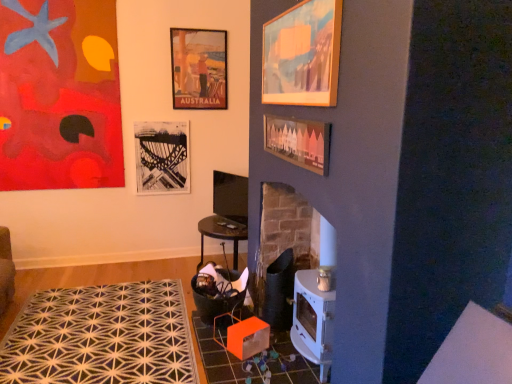
Measure the distance between point (32, 177) and camera.

Point (32, 177) and camera are 12.80 feet apart.

In the scene shown: In order to face wooden picture frame at upper center, positioned as the fifth picture frame in left-to-right order, should I rotate leftwards or rightwards?

You should look right and rotate roughly 4.920 degrees.

Find the location of a particular element. The width and height of the screenshot is (512, 384). wooden picture frame at upper center, positioned as the fifth picture frame in left-to-right order is located at coordinates (302, 55).

You are a GUI agent. You are given a task and a screenshot of the screen. Output one action in this format:
    pyautogui.click(x=<x>, y=<y>)
    Task: Click on the black paper picture frame at upper center, which is the 5th picture frame from front to back
    The height and width of the screenshot is (384, 512).
    Given the screenshot: What is the action you would take?
    pyautogui.click(x=162, y=157)

Measure the distance between point (197,81) and camera.

Point (197,81) and camera are 4.08 meters apart.

Find the location of a particular element. wooden picture frame at center, the 2th picture frame viewed from the right is located at coordinates [298, 142].

At what (x,y) coordinates should I click in order to perform the action: click on abstract painting at upper left, the 1th picture frame from the left. Please return your answer as a coordinate pair (x, y). Looking at the image, I should click on (59, 95).

Is there a large distance between abstract painting at upper left, the third picture frame positioned from the front, and matte paper poster at upper center, which is counted as the 4th picture frame, starting from the front?

No, abstract painting at upper left, the third picture frame positioned from the front, is not far away from matte paper poster at upper center, which is counted as the 4th picture frame, starting from the front.

In terms of height, does abstract painting at upper left, which ranks as the 3th picture frame in back-to-front order, look taller or shorter compared to matte paper poster at upper center, which ranks as the 2th picture frame in back-to-front order?

Considering their sizes, abstract painting at upper left, which ranks as the 3th picture frame in back-to-front order, has more height than matte paper poster at upper center, which ranks as the 2th picture frame in back-to-front order.

Is abstract painting at upper left, the third picture frame positioned from the front, surrounding matte paper poster at upper center, marked as the third picture frame in a left-to-right arrangement?

Actually, matte paper poster at upper center, marked as the third picture frame in a left-to-right arrangement, is outside abstract painting at upper left, the third picture frame positioned from the front.

Considering the relative sizes of abstract painting at upper left, the third picture frame positioned from the front, and matte paper poster at upper center, marked as the third picture frame in a left-to-right arrangement, in the image provided, is abstract painting at upper left, the third picture frame positioned from the front, smaller than matte paper poster at upper center, marked as the third picture frame in a left-to-right arrangement,?

Actually, abstract painting at upper left, the third picture frame positioned from the front, might be larger than matte paper poster at upper center, marked as the third picture frame in a left-to-right arrangement.

Does white geometric rug at lower left touch orange fabric rocking chair at lower left?

They are not placed beside each other.

Considering the sizes of white geometric rug at lower left and orange fabric rocking chair at lower left in the image, is white geometric rug at lower left bigger or smaller than orange fabric rocking chair at lower left?

Considering their sizes, white geometric rug at lower left takes up more space than orange fabric rocking chair at lower left.

Between white geometric rug at lower left and orange fabric rocking chair at lower left, which one has smaller width?

orange fabric rocking chair at lower left is thinner.

Is the depth of white geometric rug at lower left greater than that of orange fabric rocking chair at lower left?

No, the depth of white geometric rug at lower left is less than that of orange fabric rocking chair at lower left.

From a real-world perspective, is orange fabric rocking chair at lower left above or below black paper picture frame at upper center, which is counted as the 2th picture frame, starting from the left?

From a real-world perspective, orange fabric rocking chair at lower left is physically below black paper picture frame at upper center, which is counted as the 2th picture frame, starting from the left.

Between point (218, 292) and point (179, 154), which one is positioned in front?

The point (218, 292) is closer.

Which of these two, orange fabric rocking chair at lower left or black paper picture frame at upper center, the 1th picture frame when ordered from back to front, is thinner?

black paper picture frame at upper center, the 1th picture frame when ordered from back to front, is thinner.

Is orange fabric rocking chair at lower left bigger or smaller than black paper picture frame at upper center, which is the 5th picture frame from front to back?

orange fabric rocking chair at lower left is bigger than black paper picture frame at upper center, which is the 5th picture frame from front to back.

Does abstract painting at upper left, the third picture frame positioned from the front, contain black paper picture frame at upper center, the 1th picture frame when ordered from back to front?

Definitely not — black paper picture frame at upper center, the 1th picture frame when ordered from back to front, is not inside abstract painting at upper left, the third picture frame positioned from the front.

Where is `picture frame that is the 2nd one when counting upward from the black paper picture frame at upper center, which is the 5th picture frame from front to back (from the image's perspective)`? Image resolution: width=512 pixels, height=384 pixels. picture frame that is the 2nd one when counting upward from the black paper picture frame at upper center, which is the 5th picture frame from front to back (from the image's perspective) is located at coordinates (59, 95).

Is abstract painting at upper left, the third picture frame positioned from the front, looking in the opposite direction of black paper picture frame at upper center, which is the 5th picture frame from front to back?

That's not correct — abstract painting at upper left, the third picture frame positioned from the front, is not looking away from black paper picture frame at upper center, which is the 5th picture frame from front to back.

Considering the sizes of objects abstract painting at upper left, which ranks as the 3th picture frame in back-to-front order, and black paper picture frame at upper center, which is the 5th picture frame from front to back, in the image provided, who is thinner, abstract painting at upper left, which ranks as the 3th picture frame in back-to-front order, or black paper picture frame at upper center, which is the 5th picture frame from front to back,?

Thinner between the two is black paper picture frame at upper center, which is the 5th picture frame from front to back.

Could you measure the distance between orange fabric rocking chair at lower left and wooden picture frame at center, acting as the 4th picture frame starting from the left?

orange fabric rocking chair at lower left and wooden picture frame at center, acting as the 4th picture frame starting from the left, are 1.17 meters apart.

Considering the positions of point (225, 310) and point (283, 153), is point (225, 310) closer or farther from the camera than point (283, 153)?

Point (225, 310).

Is orange fabric rocking chair at lower left not inside wooden picture frame at center, the 2th picture frame viewed from the right?

Yes, orange fabric rocking chair at lower left is outside of wooden picture frame at center, the 2th picture frame viewed from the right.

Between orange fabric rocking chair at lower left and wooden picture frame at center, acting as the 4th picture frame starting from the left, which one has more height?

orange fabric rocking chair at lower left.

Which object is thinner, abstract painting at upper left, which ranks as the 3th picture frame in back-to-front order, or wooden picture frame at upper center, which is the first picture frame in front-to-back order?

Thinner between the two is wooden picture frame at upper center, which is the first picture frame in front-to-back order.

Considering the points (81, 1) and (276, 62), which point is behind, point (81, 1) or point (276, 62)?

The point (81, 1) is more distant.

From a real-world perspective, which object stands above the other?

In real-world perspective, wooden picture frame at upper center, positioned as the fifth picture frame in back-to-front order, is above.

Are abstract painting at upper left, the 1th picture frame from the left, and wooden picture frame at upper center, positioned as the fifth picture frame in back-to-front order, beside each other?

No, abstract painting at upper left, the 1th picture frame from the left, is not beside wooden picture frame at upper center, positioned as the fifth picture frame in back-to-front order.

From the image's perspective, who appears lower, orange fabric rocking chair at lower left or wooden picture frame at upper center, which is the first picture frame in front-to-back order?

orange fabric rocking chair at lower left, from the image's perspective.

Would you say orange fabric rocking chair at lower left is a long distance from wooden picture frame at upper center, positioned as the fifth picture frame in back-to-front order?

Yes, orange fabric rocking chair at lower left and wooden picture frame at upper center, positioned as the fifth picture frame in back-to-front order, are quite far apart.

Is orange fabric rocking chair at lower left facing towards wooden picture frame at upper center, which is the first picture frame in front-to-back order?

No, orange fabric rocking chair at lower left does not turn towards wooden picture frame at upper center, which is the first picture frame in front-to-back order.

From a real-world perspective, count 2nd picture frames upward from the abstract painting at upper left, the 1th picture frame from the left, and point to it. Please provide its 2D coordinates.

[(199, 68)]

Find the location of a particular element. The height and width of the screenshot is (384, 512). rocking chair on the right of white geometric rug at lower left is located at coordinates point(220,295).

Considering their positions, is wooden picture frame at upper center, positioned as the 1th picture frame in right-to-left order, positioned further to orange fabric rocking chair at lower left than wooden picture frame at center, the 2th picture frame viewed from the right?

wooden picture frame at upper center, positioned as the 1th picture frame in right-to-left order, is further to orange fabric rocking chair at lower left.

From the picture: Looking at the image, which one is located further to matte paper poster at upper center, acting as the third picture frame starting from the right, wooden picture frame at center, the fourth picture frame viewed from the back, or orange fabric rocking chair at lower left?

orange fabric rocking chair at lower left lies further to matte paper poster at upper center, acting as the third picture frame starting from the right, than the other object.

When comparing their distances from wooden picture frame at center, the 2th picture frame viewed from the right, does abstract painting at upper left, the third picture frame positioned from the front, or matte paper poster at upper center, acting as the third picture frame starting from the right, seem further?

The object further to wooden picture frame at center, the 2th picture frame viewed from the right, is abstract painting at upper left, the third picture frame positioned from the front.

Based on their spatial positions, is matte paper poster at upper center, acting as the third picture frame starting from the right, or orange fabric rocking chair at lower left closer to abstract painting at upper left, which ranks as the 3th picture frame in back-to-front order?

Based on the image, matte paper poster at upper center, acting as the third picture frame starting from the right, appears to be nearer to abstract painting at upper left, which ranks as the 3th picture frame in back-to-front order.

Considering their positions, is wooden picture frame at upper center, positioned as the 1th picture frame in right-to-left order, positioned further to matte paper poster at upper center, which ranks as the 2th picture frame in back-to-front order, than wooden picture frame at center, the fourth picture frame viewed from the back?

Among the two, wooden picture frame at upper center, positioned as the 1th picture frame in right-to-left order, is located further to matte paper poster at upper center, which ranks as the 2th picture frame in back-to-front order.

Considering their positions, is orange fabric rocking chair at lower left positioned closer to abstract painting at upper left, the 1th picture frame from the left, than wooden picture frame at upper center, positioned as the fifth picture frame in back-to-front order?

A: orange fabric rocking chair at lower left.

Estimate the real-world distances between objects in this image. Which object is closer to abstract painting at upper left, which appears as the 5th picture frame when viewed from the right, wooden picture frame at center, the 2th picture frame viewed from the right, or orange fabric rocking chair at lower left?

orange fabric rocking chair at lower left is positioned closer to the anchor abstract painting at upper left, which appears as the 5th picture frame when viewed from the right.

Looking at the image, which one is located closer to matte paper poster at upper center, marked as the third picture frame in a left-to-right arrangement, orange fabric rocking chair at lower left or wooden picture frame at center, positioned as the second picture frame in front-to-back order?

wooden picture frame at center, positioned as the second picture frame in front-to-back order.

Find the location of a particular element. This screenshot has height=384, width=512. mat positioned between wooden picture frame at center, the fourth picture frame viewed from the back, and black paper picture frame at upper center, the 1th picture frame when ordered from back to front, from near to far is located at coordinates (101, 337).

Where is `mat between abstract painting at upper left, which appears as the 5th picture frame when viewed from the right, and wooden picture frame at upper center, which is the first picture frame in front-to-back order, in the horizontal direction`? mat between abstract painting at upper left, which appears as the 5th picture frame when viewed from the right, and wooden picture frame at upper center, which is the first picture frame in front-to-back order, in the horizontal direction is located at coordinates pyautogui.click(x=101, y=337).

Image resolution: width=512 pixels, height=384 pixels. I want to click on rocking chair between abstract painting at upper left, the 1th picture frame from the left, and wooden picture frame at center, the 2th picture frame viewed from the right, so click(x=220, y=295).

You are a GUI agent. You are given a task and a screenshot of the screen. Output one action in this format:
    pyautogui.click(x=<x>, y=<y>)
    Task: Click on the rocking chair between wooden picture frame at center, acting as the 4th picture frame starting from the left, and black paper picture frame at upper center, the 1th picture frame when ordered from back to front, along the z-axis
    The height and width of the screenshot is (384, 512).
    Given the screenshot: What is the action you would take?
    pyautogui.click(x=220, y=295)